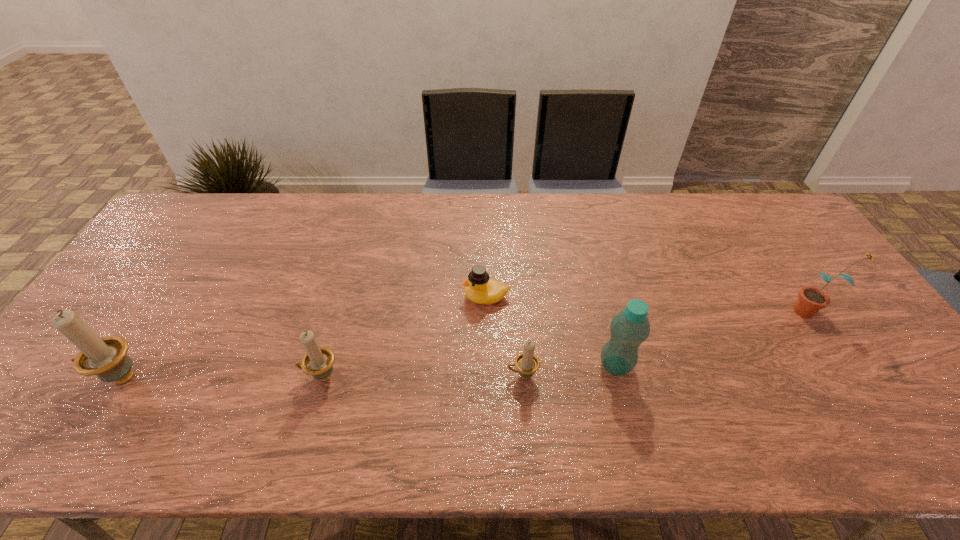
Identify the location of vacant space at the near edge of the desktop. The image size is (960, 540). (372, 407).

Locate an element on the screen. Image resolution: width=960 pixels, height=540 pixels. free space at the right edge is located at coordinates (820, 315).

Identify the location of vacant space at the far left corner. (196, 206).

Where is `vacant space at the far right corner of the desktop`? vacant space at the far right corner of the desktop is located at coordinates (779, 207).

Locate an element on the screen. This screenshot has height=540, width=960. empty location between the sunflower and the duck is located at coordinates (649, 303).

The image size is (960, 540). In order to click on empty space that is in between the leftmost object and the rightmost object in this screenshot , I will do `click(465, 344)`.

Locate an element on the screen. unoccupied position between the tallest candle_holder and the water bottle is located at coordinates pos(368,372).

This screenshot has width=960, height=540. What are the coordinates of `free spot between the sunflower and the shortest candle_holder` in the screenshot? It's located at (666, 343).

The height and width of the screenshot is (540, 960). In order to click on empty space that is in between the sunflower and the rightmost candle_holder in this screenshot , I will do `click(666, 343)`.

Find the location of a particular element. Image resolution: width=960 pixels, height=540 pixels. vacant space that is in between the second object from right to left and the shortest candle_holder is located at coordinates (569, 370).